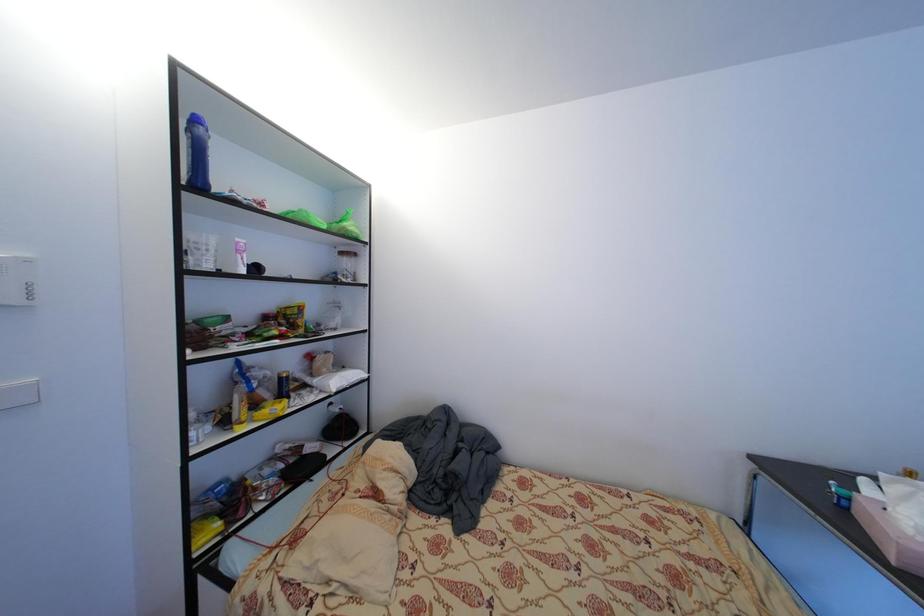
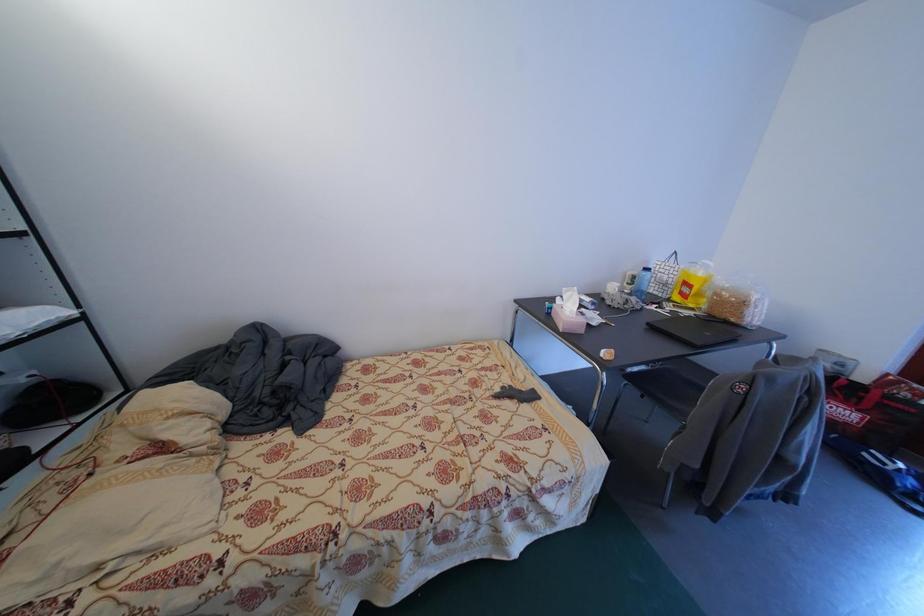
First-person continuous shooting, in which direction is the camera rotating?

The rotation direction of the camera is right-down.